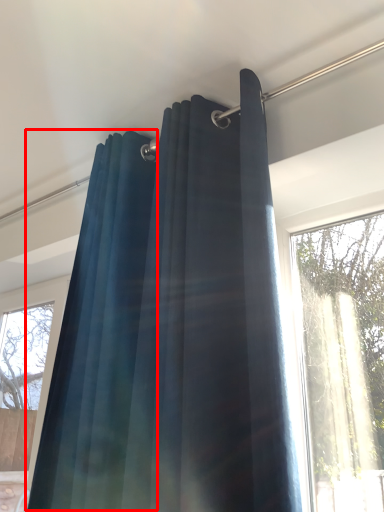
Question: In this image, where is shower curtain (annotated by the red box) located relative to curtain?

Choices:
 (A) left
 (B) right

Answer: (A)